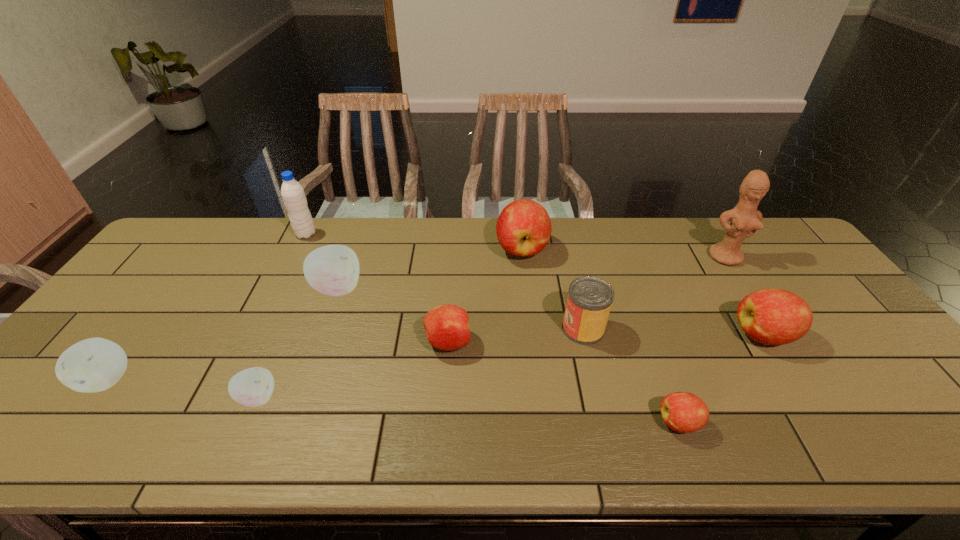
The image size is (960, 540). Identify the location of the leftmost apple. (92, 365).

Locate an element on the screen. The image size is (960, 540). the leftmost object is located at coordinates (92, 365).

At what (x,y) coordinates should I click in order to perform the action: click on the sixth object from right to left. Please return your answer as a coordinate pair (x, y). Image resolution: width=960 pixels, height=540 pixels. Looking at the image, I should click on (447, 327).

Identify the location of the fourth apple from right to left. (447, 327).

Where is `the smallest white apple`? the smallest white apple is located at coordinates (252, 387).

Where is `the eighth object from left to right`? The height and width of the screenshot is (540, 960). the eighth object from left to right is located at coordinates coord(683,412).

Where is `the second apple from right to left`? The width and height of the screenshot is (960, 540). the second apple from right to left is located at coordinates (683, 412).

Find the location of a particular element. The height and width of the screenshot is (540, 960). free space located 0.210m on the front-facing side of the tallest object is located at coordinates (765, 317).

Find the location of a particular element. This screenshot has width=960, height=540. free location located on the right of the ninth shortest object is located at coordinates (402, 234).

Where is `vacant space positioned 0.150m on the right of the farthest apple`? The height and width of the screenshot is (540, 960). vacant space positioned 0.150m on the right of the farthest apple is located at coordinates (594, 249).